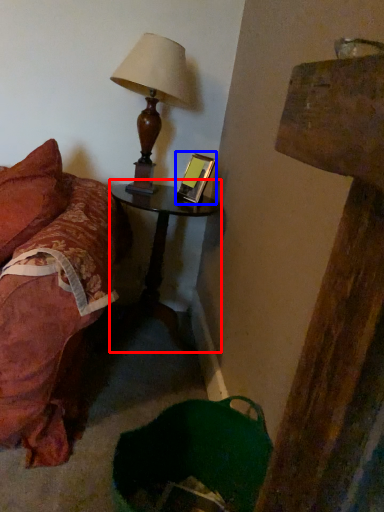
Question: Which of the following is the closest to the observer, nightstand (highlighted by a red box) or picture frame (highlighted by a blue box)?

Choices:
 (A) nightstand
 (B) picture frame

Answer: (A)